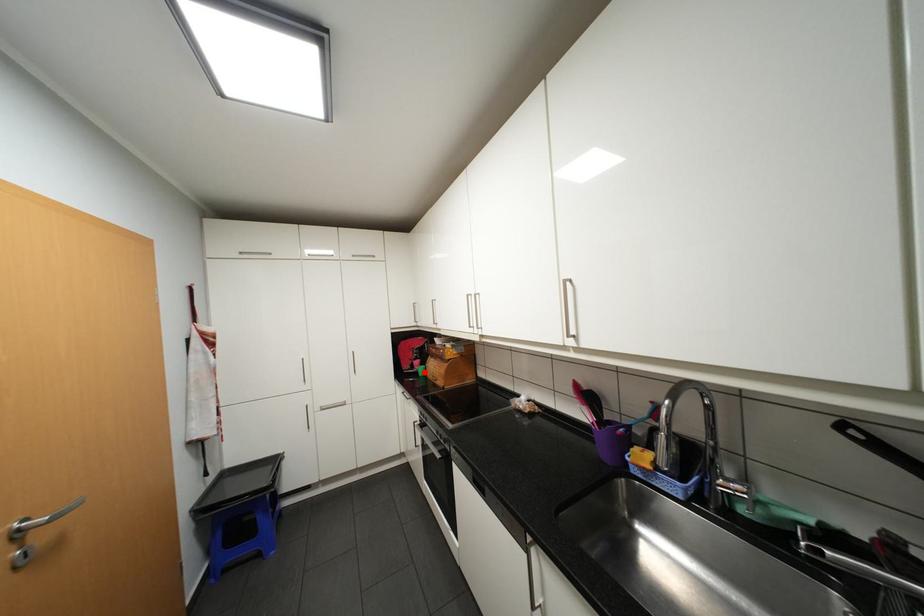
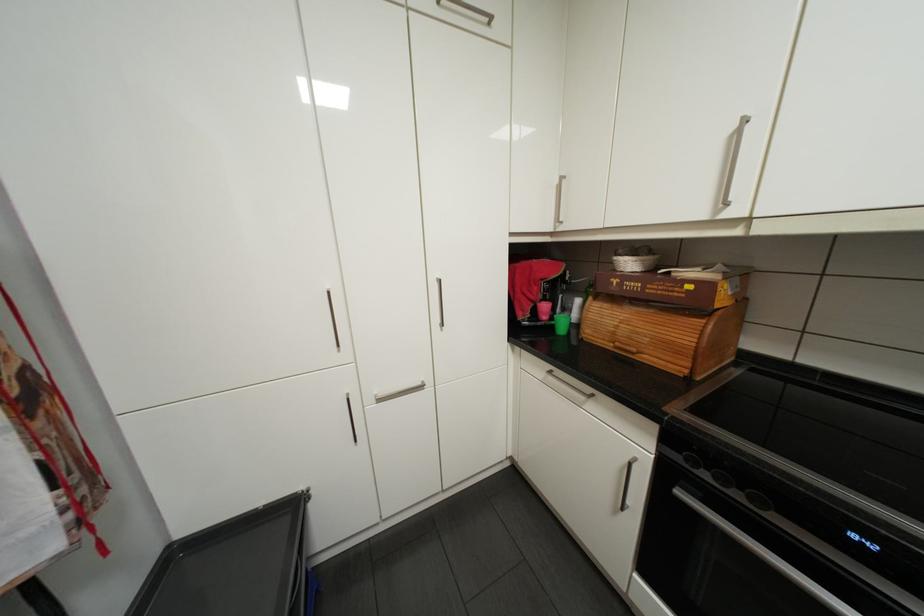
Question: I am providing you with two images of the same scene from different viewpoints. Image1 has a red point marked. In image2, the corresponding 3D location appears at what relative position? Reply with the corresponding letter.

Choices:
 (A) Closer
 (B) Farther

Answer: (A)